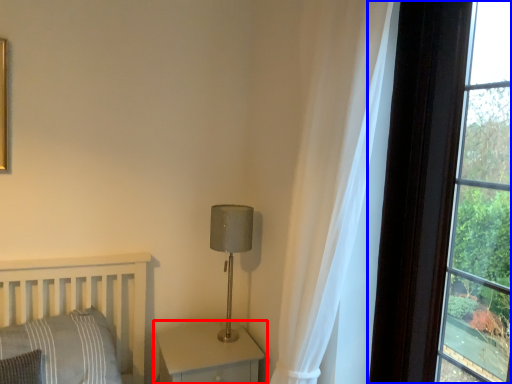
Question: Which of the following is the farthest to the observer, nightstand (highlighted by a red box) or window (highlighted by a blue box)?

Choices:
 (A) nightstand
 (B) window

Answer: (A)